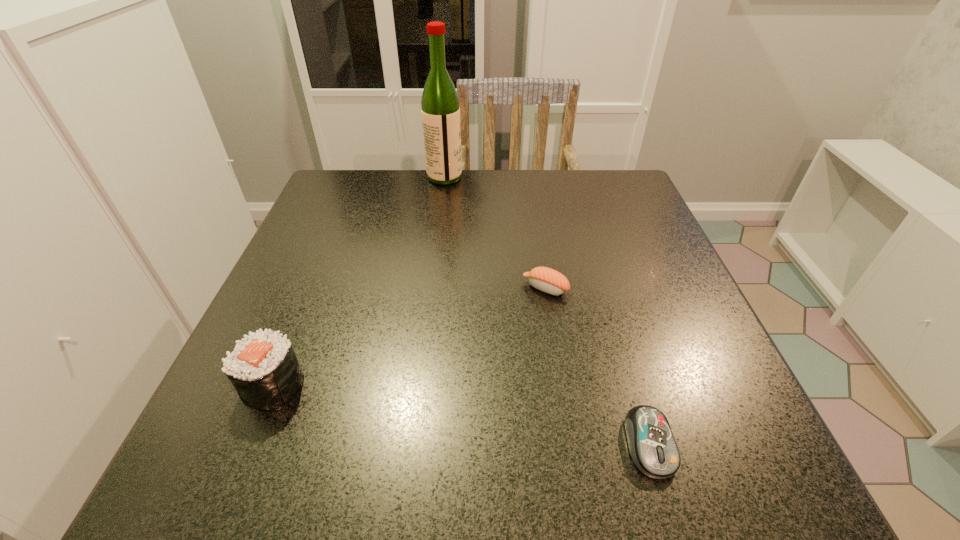
In the image, there is a desktop. Find the location of `vacant space at the far right corner`. vacant space at the far right corner is located at coordinates (605, 205).

You are a GUI agent. You are given a task and a screenshot of the screen. Output one action in this format:
    pyautogui.click(x=<x>, y=<y>)
    Task: Click on the blank region between the nearest object and the leftmost object
    The width and height of the screenshot is (960, 540).
    Given the screenshot: What is the action you would take?
    pyautogui.click(x=461, y=414)

Identify the location of empty space that is in between the rightmost object and the third shortest object. Image resolution: width=960 pixels, height=540 pixels. (461, 414).

Identify the location of unoccupied position between the computer mouse and the farther sushi. This screenshot has width=960, height=540. (597, 366).

Identify the location of vacant area that lies between the second farthest object and the tallest object. 495,233.

Image resolution: width=960 pixels, height=540 pixels. What are the coordinates of `unoccupied position between the leftmost object and the shortest object` in the screenshot? It's located at (461, 414).

The height and width of the screenshot is (540, 960). Identify the location of free spot between the second farthest object and the tallest object. (495, 233).

At what (x,y) coordinates should I click in order to perform the action: click on empty space that is in between the right sushi and the second object from left to right. Please return your answer as a coordinate pair (x, y). This screenshot has height=540, width=960. Looking at the image, I should click on click(495, 233).

The height and width of the screenshot is (540, 960). In order to click on vacant area that lies between the tallest object and the computer mouse in this screenshot , I will do `click(547, 311)`.

Locate an element on the screen. This screenshot has height=540, width=960. blank region between the shortest object and the farther sushi is located at coordinates (597, 366).